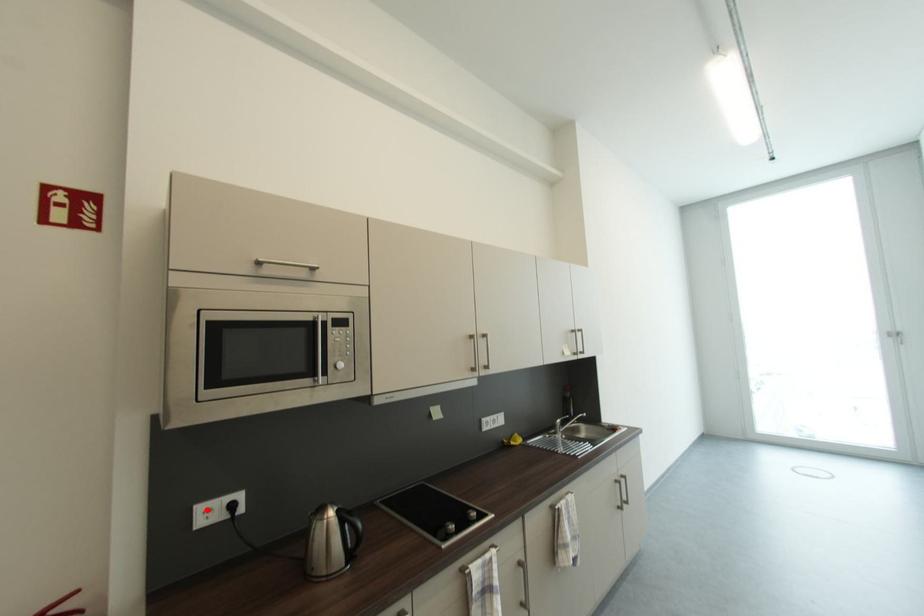
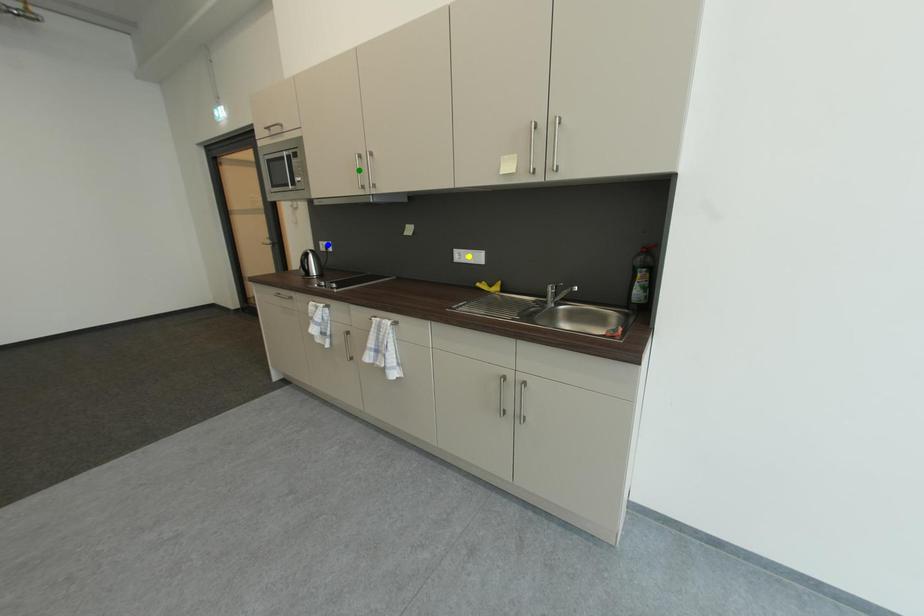
Question: I am providing you with two images of the same scene from different viewpoints. A red point is marked on the first image. You are given multiple points on the second image. Can you choose the point in image 2 that corresponds to the point in image 1?

Choices:
 (A) yellow point
 (B) green point
 (C) blue point

Answer: (C)